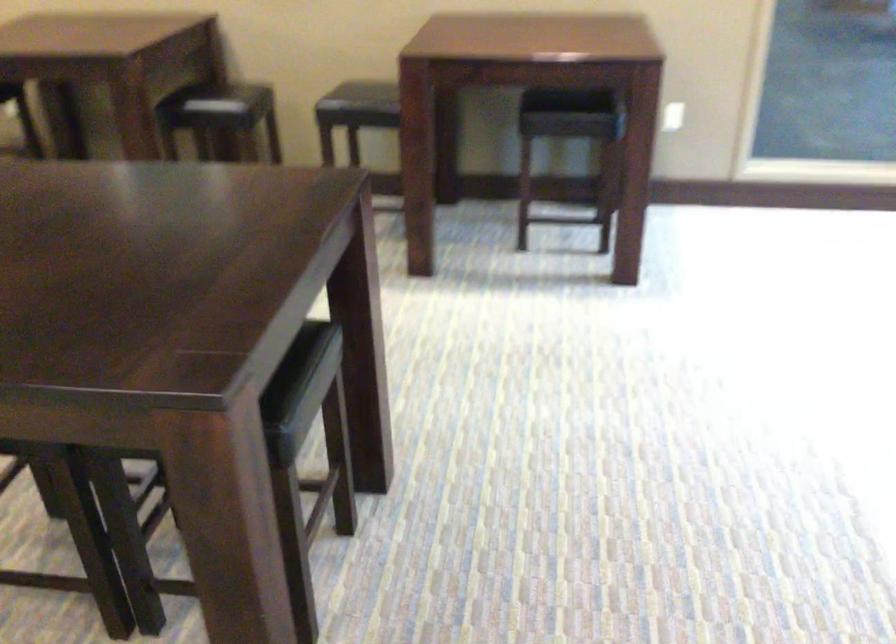
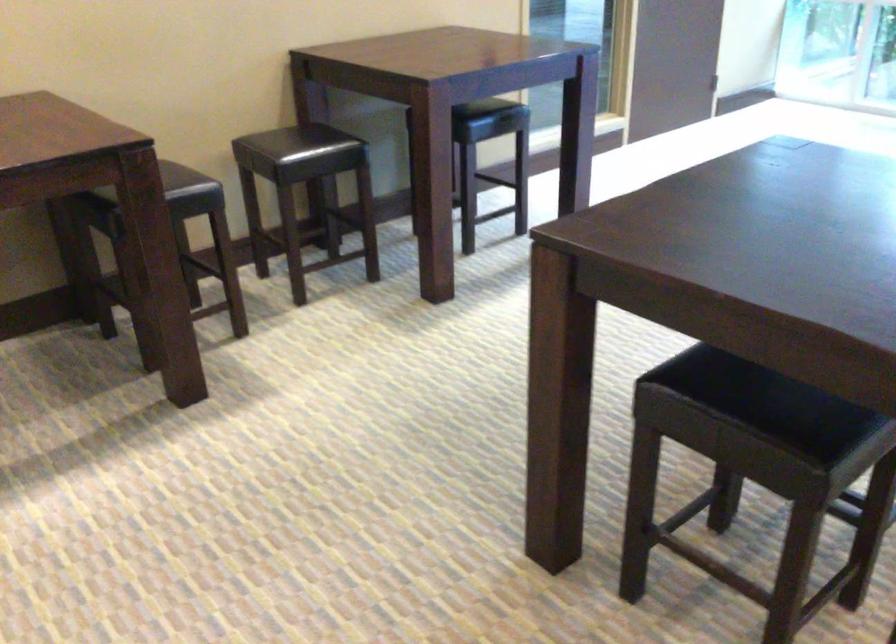
The point at (135,79) is marked in the first image. Where is the corresponding point in the second image?

(168, 182)